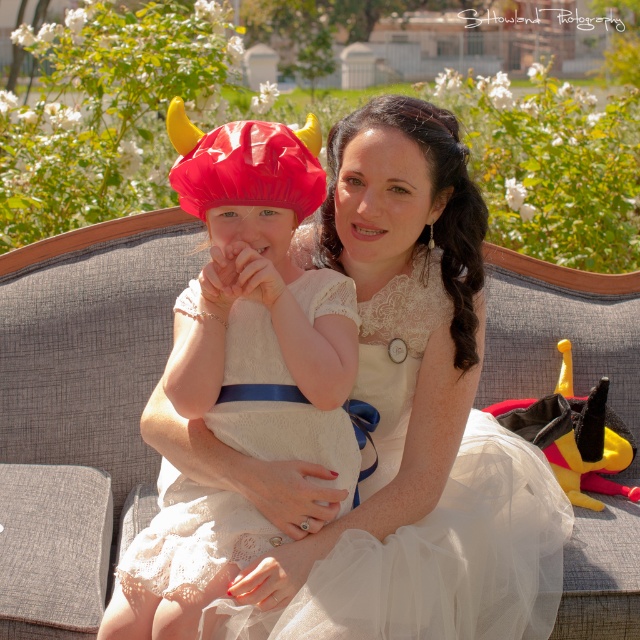
You are a fashion designer who wants to create a new outfit combining elements from both the lace fabric dress at center and the matte white dress at center. However, you need to ensure the combined design can fit within a 16 inch width requirement. Given their current separation, will the combined design exceed the limit?

The lace fabric dress at center and matte white dress at center are 14.67 inches apart from each other. Since the combined design needs to fit within a 16 inch width requirement, the 14.67 inches is less than 16 inches, so the combined design will not exceed the limit.

You are a photographer trying to capture the lace fabric dress at center and the matte white dress at center in the same frame. Which dress should you focus on first to ensure both are in focus?

The lace fabric dress at center is closer to the viewer than the matte white dress at center, so you should focus on the lace fabric dress at center first to ensure both are in focus.

You are a photographer trying to capture the lace fabric dress at center and the matte white dress at center in the same frame. Which dress should you focus on first if you want to include both in your shot without moving the camera?

The lace fabric dress at center is positioned on the right side of matte white dress at center, so you should focus on the matte white dress at center first to ensure both dresses are within the frame.